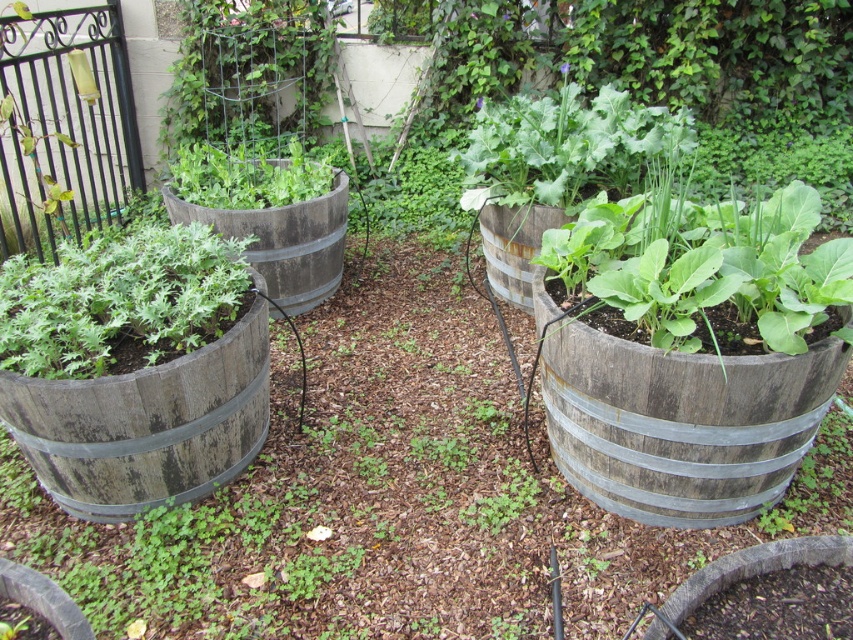
Question: Which point appears farthest from the camera in this image?

Choices:
 (A) pyautogui.click(x=20, y=371)
 (B) pyautogui.click(x=73, y=428)
 (C) pyautogui.click(x=708, y=442)
 (D) pyautogui.click(x=277, y=312)

Answer: (D)

Question: Which object is farther from the camera taking this photo?

Choices:
 (A) green matte barrel at left
 (B) weathered wood barrel at center
 (C) rusty wood barrel at center-right
 (D) wooden barrel at left

Answer: (C)

Question: Is weathered wood barrel at center below green matte barrel at left?

Choices:
 (A) yes
 (B) no

Answer: (A)

Question: Which point is closer to the camera?

Choices:
 (A) (222, 481)
 (B) (519, 305)
 (C) (662, 353)

Answer: (C)

Question: Is green matte barrel at left thinner than gray wood barrel at center?

Choices:
 (A) yes
 (B) no

Answer: (A)

Question: Does weathered wood barrel at center appear on the right side of gray wood barrel at center?

Choices:
 (A) yes
 (B) no

Answer: (A)